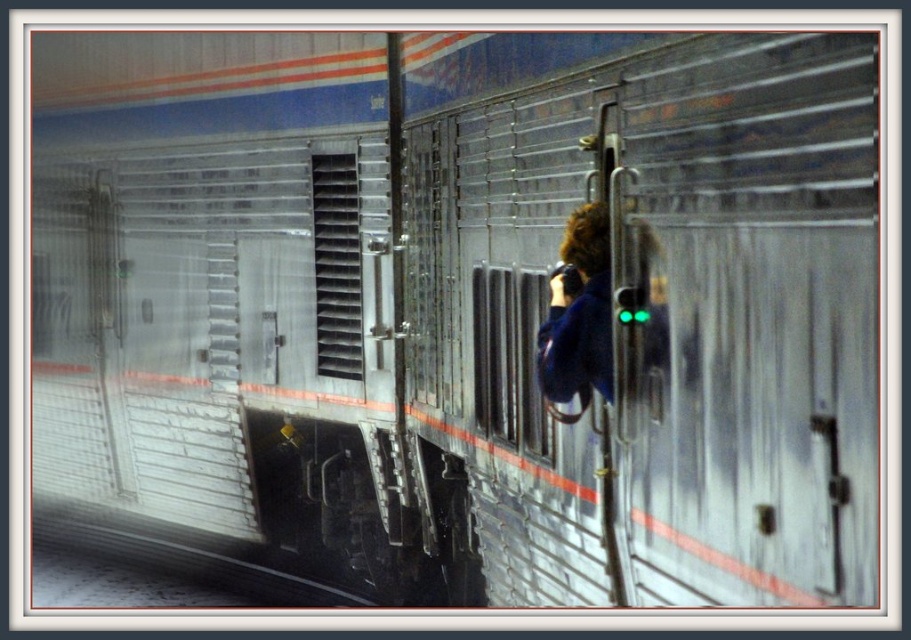
The height and width of the screenshot is (640, 911). Find the location of `gray concrete train track at lower left`. gray concrete train track at lower left is located at coordinates [187, 556].

Can you confirm if gray concrete train track at lower left is wider than blue fabric jacket at center?

Indeed, gray concrete train track at lower left has a greater width compared to blue fabric jacket at center.

Which is behind, point (41, 504) or point (661, 368)?

Point (41, 504)

The image size is (911, 640). What are the coordinates of `gray concrete train track at lower left` in the screenshot? It's located at (187, 556).